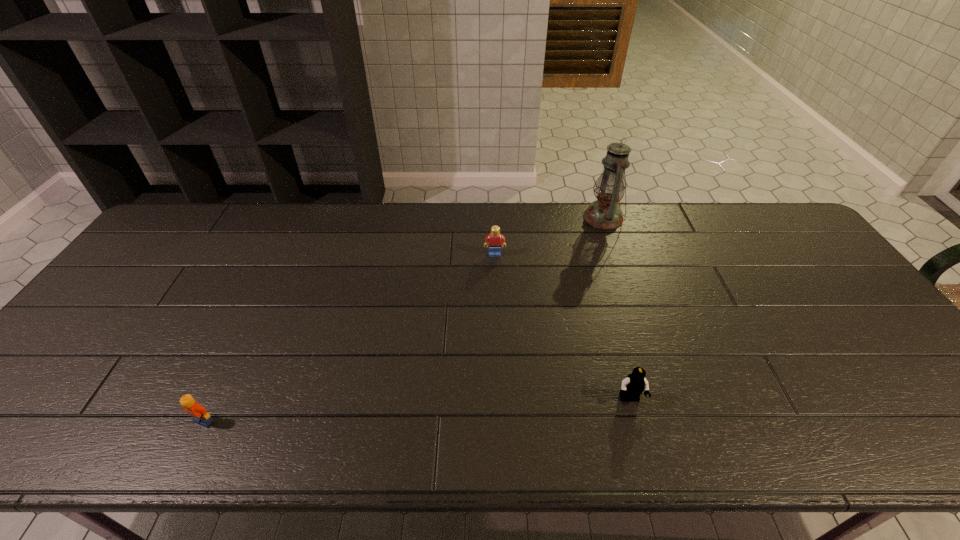
I want to click on Lego that is the closest one to the third farthest object, so click(494, 240).

The image size is (960, 540). I want to click on Lego that is the closest to the second farthest object, so coord(633,386).